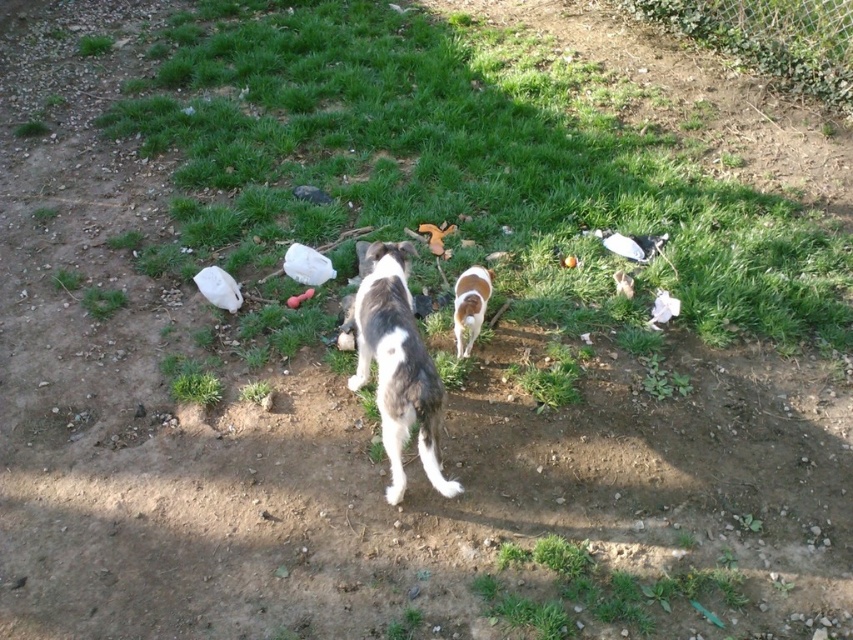
Question: Is white fur dog at center positioned behind brown and white fur at center?

Choices:
 (A) no
 (B) yes

Answer: (A)

Question: Among these points, which one is nearest to the camera?

Choices:
 (A) (460, 344)
 (B) (402, 314)

Answer: (B)

Question: Observing the image, what is the correct spatial positioning of white fur dog at center in reference to brown and white fur at center?

Choices:
 (A) right
 (B) left

Answer: (B)

Question: Among these objects, which one is nearest to the camera?

Choices:
 (A) white fur dog at center
 (B) brown and white fur at center

Answer: (A)

Question: Can you confirm if white fur dog at center is bigger than brown and white fur at center?

Choices:
 (A) no
 (B) yes

Answer: (B)